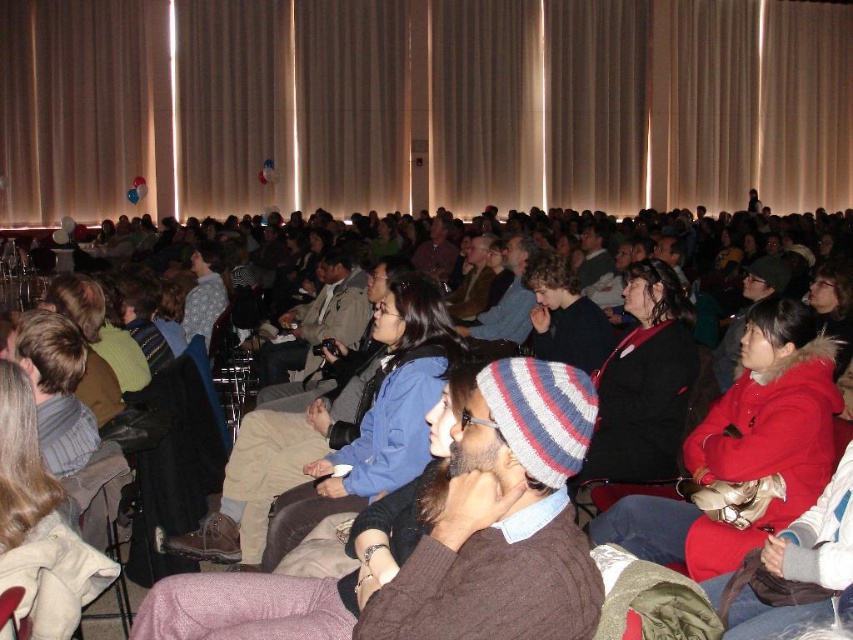
Question: Which of the following is the closest to the observer?

Choices:
 (A) (206, 275)
 (B) (408, 352)

Answer: (B)

Question: Considering the relative positions of striped knit beanie at center and patterned sweater at center in the image provided, where is striped knit beanie at center located with respect to patterned sweater at center?

Choices:
 (A) below
 (B) above

Answer: (A)

Question: Is blue cotton jacket at center wider than striped knit beanie at center?

Choices:
 (A) yes
 (B) no

Answer: (A)

Question: Is red fuzzy coat at center behind blue cotton jacket at center?

Choices:
 (A) no
 (B) yes

Answer: (A)

Question: Considering the real-world distances, which object is farthest from the patterned sweater at center?

Choices:
 (A) knitted wool beanie at center
 (B) blue cotton jacket at center
 (C) red fuzzy coat at center
 (D) dark blue knit hat at center

Answer: (C)

Question: Which point appears farthest from the camera in this image?

Choices:
 (A) (257, 560)
 (B) (355, 602)
 (C) (769, 324)
 (D) (608, 356)

Answer: (D)